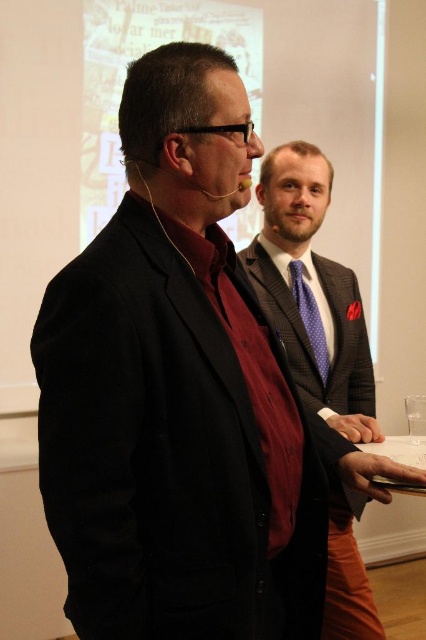
Question: In this image, where is plaid wool suit at center located relative to purple dotted tie at center?

Choices:
 (A) left
 (B) right

Answer: (A)

Question: Can you confirm if plaid wool suit at center is positioned below purple dotted tie at center?

Choices:
 (A) no
 (B) yes

Answer: (B)

Question: Is plaid wool suit at center bigger than purple dotted tie at center?

Choices:
 (A) yes
 (B) no

Answer: (A)

Question: Which point is closer to the camera taking this photo?

Choices:
 (A) (357, 515)
 (B) (322, 356)

Answer: (A)

Question: Which point is farther from the camera taking this photo?

Choices:
 (A) (336, 486)
 (B) (293, 288)

Answer: (B)